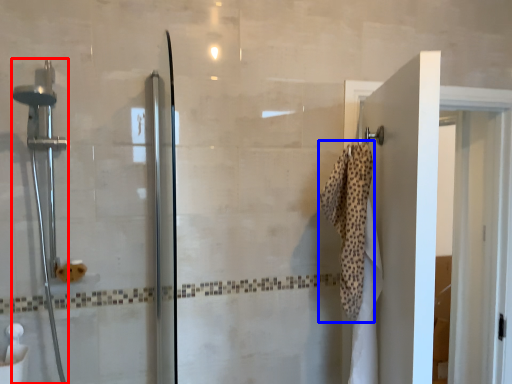
Question: Which point is closer to the camera, shower (highlighted by a red box) or bath towel (highlighted by a blue box)?

Choices:
 (A) shower
 (B) bath towel

Answer: (A)